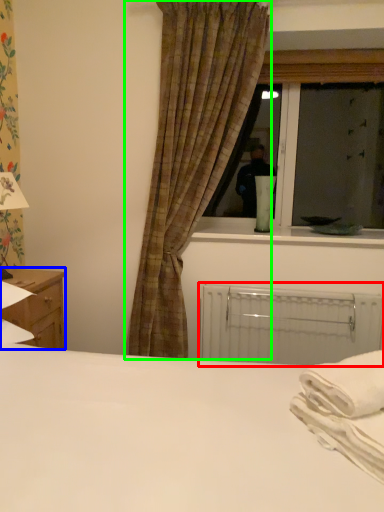
Question: Based on their relative distances, which object is nearer to radiator (highlighted by a red box)? Choose from nightstand (highlighted by a blue box) and curtain (highlighted by a green box).

Choices:
 (A) nightstand
 (B) curtain

Answer: (B)